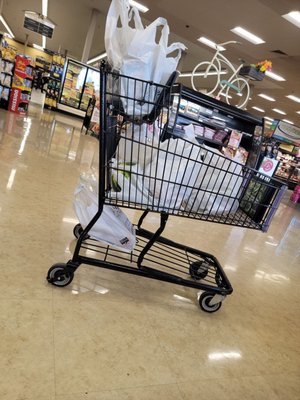
This screenshot has height=400, width=300. What are the coordinates of `ceiling lights` in the screenshot? It's located at (256, 40).